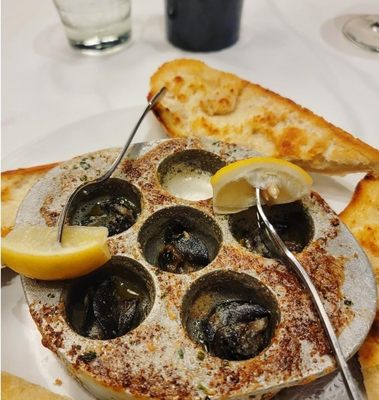
You are a GUI agent. You are given a task and a screenshot of the screen. Output one action in this format:
    pyautogui.click(x=<x>, y=<y>)
    Task: Click on the white plate
    
    Given the screenshot: What is the action you would take?
    pyautogui.click(x=101, y=134)